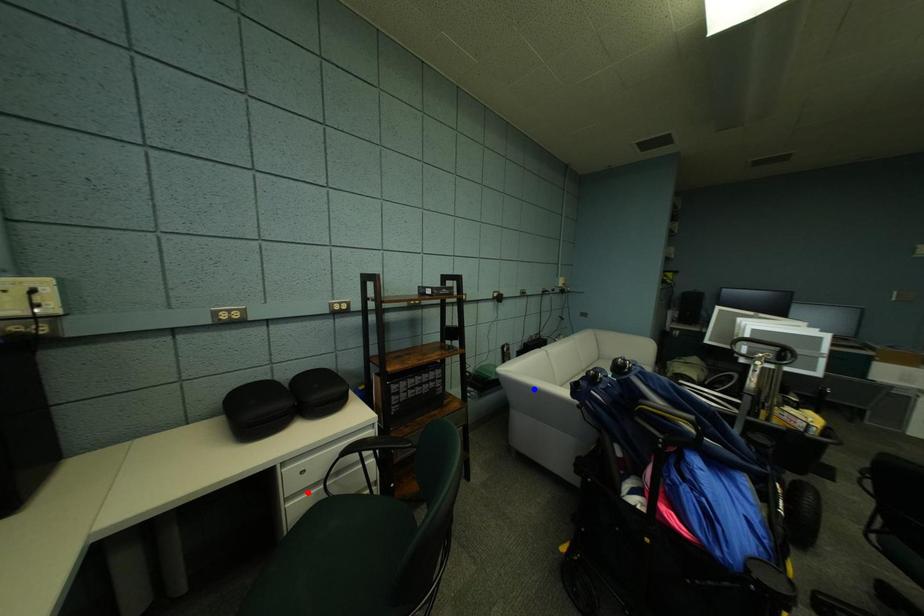
Question: Two points are marked on the image. Which point is closer to the camera?

Choices:
 (A) Blue point is closer.
 (B) Red point is closer.

Answer: (B)